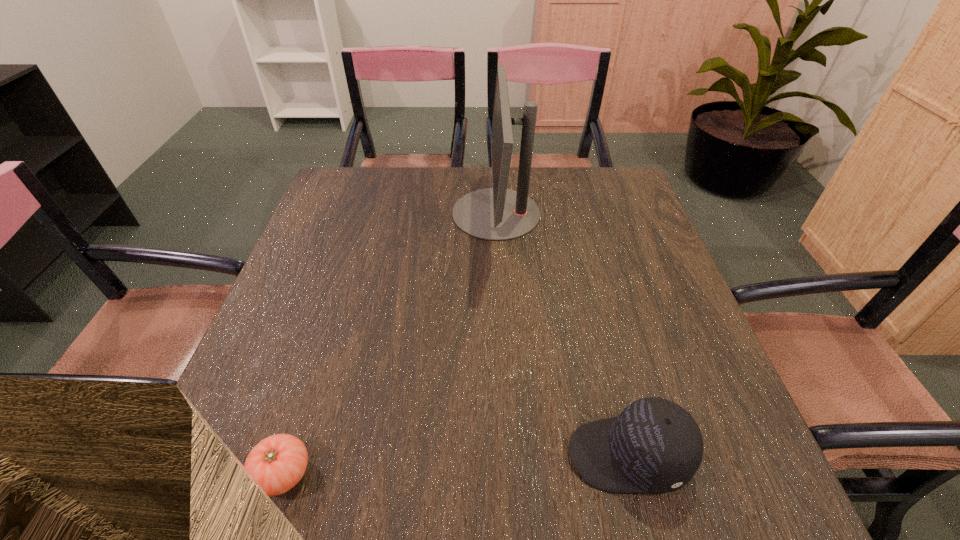
This screenshot has width=960, height=540. What are the coordinates of `the tallest object` in the screenshot? It's located at (497, 214).

The width and height of the screenshot is (960, 540). What are the coordinates of `computer monitor` in the screenshot? It's located at (497, 214).

The width and height of the screenshot is (960, 540). What are the coordinates of `baseball cap` in the screenshot? It's located at (654, 445).

The image size is (960, 540). In order to click on tomato in this screenshot , I will do (277, 463).

The width and height of the screenshot is (960, 540). In order to click on the shortest object in this screenshot , I will do [x=277, y=463].

This screenshot has height=540, width=960. What are the coordinates of `vacant space located on the screen of the computer monitor` in the screenshot? It's located at (402, 213).

You are a GUI agent. You are given a task and a screenshot of the screen. Output one action in this format:
    pyautogui.click(x=<x>, y=<y>)
    Task: Click on the vacant region located 0.320m on the screen of the computer monitor
    
    Given the screenshot: What is the action you would take?
    pyautogui.click(x=338, y=213)

At what (x,y) coordinates should I click in order to perform the action: click on free space located on the screen of the computer monitor. Please return your answer as a coordinate pair (x, y). Looking at the image, I should click on (x=338, y=213).

The height and width of the screenshot is (540, 960). I want to click on free space located at the front of the second tallest object where the brim is located, so click(414, 455).

The height and width of the screenshot is (540, 960). Identify the location of vacant space positioned at the front of the second tallest object where the brim is located. (521, 455).